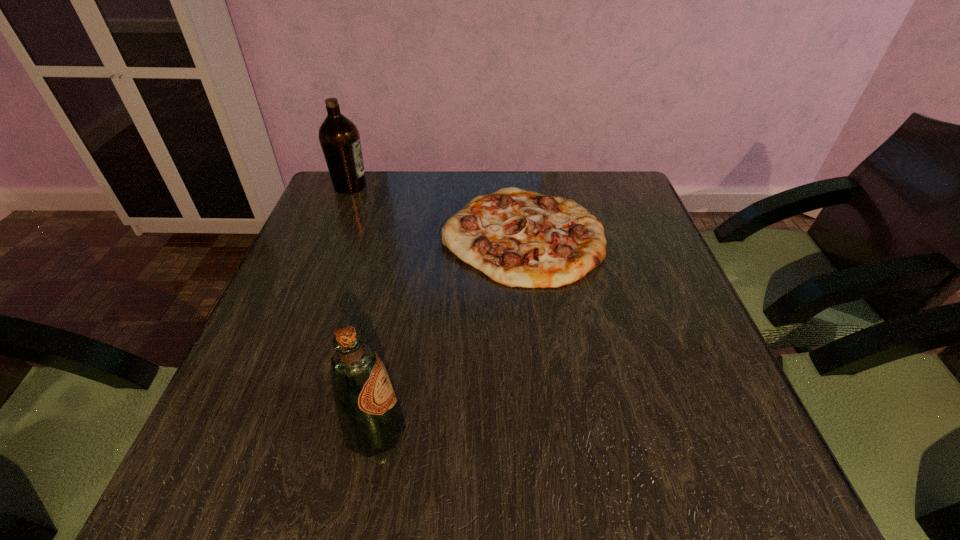
I want to click on vacant area that lies between the leftmost object and the pizza, so click(437, 210).

This screenshot has width=960, height=540. Find the location of `vacant region between the shortest object and the nearer olive oil`. vacant region between the shortest object and the nearer olive oil is located at coordinates (449, 333).

At what (x,y) coordinates should I click in order to perform the action: click on vacant area between the second object from left to right and the rightmost object. Please return your answer as a coordinate pair (x, y). This screenshot has height=540, width=960. Looking at the image, I should click on (449, 333).

This screenshot has width=960, height=540. Identify the location of object that is the nearest to the second object from left to right. (518, 238).

Select which object appears as the second closest to the shortest object. Please provide its 2D coordinates. Your answer should be formatted as a tuple, i.e. [(x, y)], where the tuple contains the x and y coordinates of a point satisfying the conditions above.

[(371, 420)]

At what (x,y) coordinates should I click in order to perform the action: click on vacant region that satisfies the following two spatial constraints: 1. on the label of the rightmost object; 2. on the left side of the farther olive oil. Please return your answer as a coordinate pair (x, y). This screenshot has width=960, height=540. Looking at the image, I should click on (330, 234).

You are a GUI agent. You are given a task and a screenshot of the screen. Output one action in this format:
    pyautogui.click(x=<x>, y=<y>)
    Task: Click on the vacant region that satisfies the following two spatial constraints: 1. on the label of the shortest object; 2. on the left side of the leftmost object
    The width and height of the screenshot is (960, 540).
    Given the screenshot: What is the action you would take?
    point(330,234)

In order to click on vacant region that satisfies the following two spatial constraints: 1. on the label of the pizza; 2. on the right side of the left olive oil in this screenshot , I will do `click(330, 234)`.